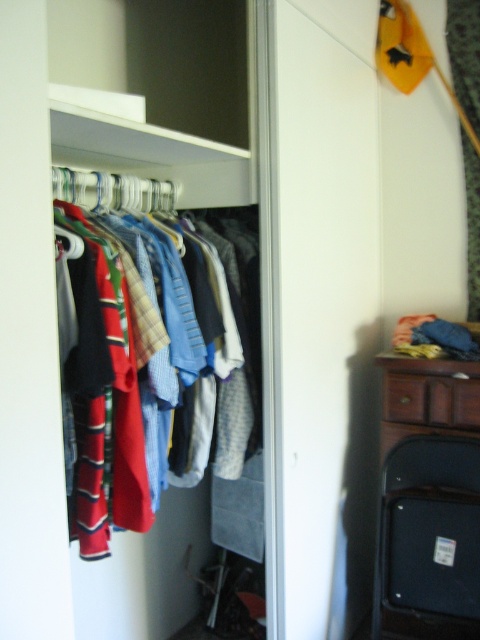
Question: Is black hard suitcase at lower right positioned in front of white fabric curtain at upper right?

Choices:
 (A) no
 (B) yes

Answer: (B)

Question: Is black hard suitcase at lower right smaller than brown wood drawer at right?

Choices:
 (A) no
 (B) yes

Answer: (A)

Question: Estimate the real-world distances between objects in this image. Which object is farther from the white fabric curtain at upper right?

Choices:
 (A) multicolored fabric shirts at center
 (B) metallic silver hanger at center
 (C) brown wood drawer at right
 (D) black hard suitcase at lower right

Answer: (B)

Question: Is brown wood drawer at right wider than metallic silver hanger at center?

Choices:
 (A) yes
 (B) no

Answer: (A)

Question: Which object is the farthest from the black hard suitcase at lower right?

Choices:
 (A) white fabric curtain at upper right
 (B) multicolored fabric shirts at center

Answer: (A)

Question: Which of the following is the farthest from the observer?

Choices:
 (A) (160, 208)
 (B) (416, 444)
 (C) (419, 419)
 (D) (452, 20)

Answer: (D)